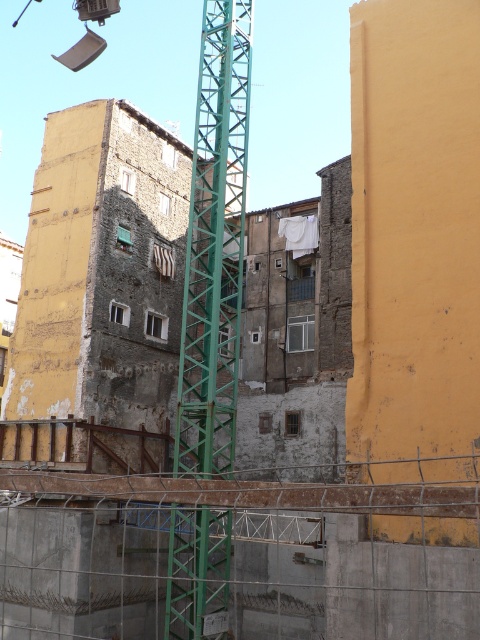
Question: Is green metal tower crane at center further to the viewer compared to green metallic tower crane at center?

Choices:
 (A) no
 (B) yes

Answer: (A)

Question: Which object appears closest to the camera in this image?

Choices:
 (A) green metallic tower crane at center
 (B) green metal tower crane at center

Answer: (B)

Question: Which of the following is the closest to the observer?

Choices:
 (A) (442, 545)
 (B) (225, 68)

Answer: (A)

Question: Does green metal tower crane at center have a greater width compared to green metallic tower crane at center?

Choices:
 (A) yes
 (B) no

Answer: (A)

Question: Can you confirm if green metal tower crane at center is positioned to the left of green metallic tower crane at center?

Choices:
 (A) yes
 (B) no

Answer: (B)

Question: Which of the following is the farthest from the observer?

Choices:
 (A) (204, 212)
 (B) (57, 433)

Answer: (B)